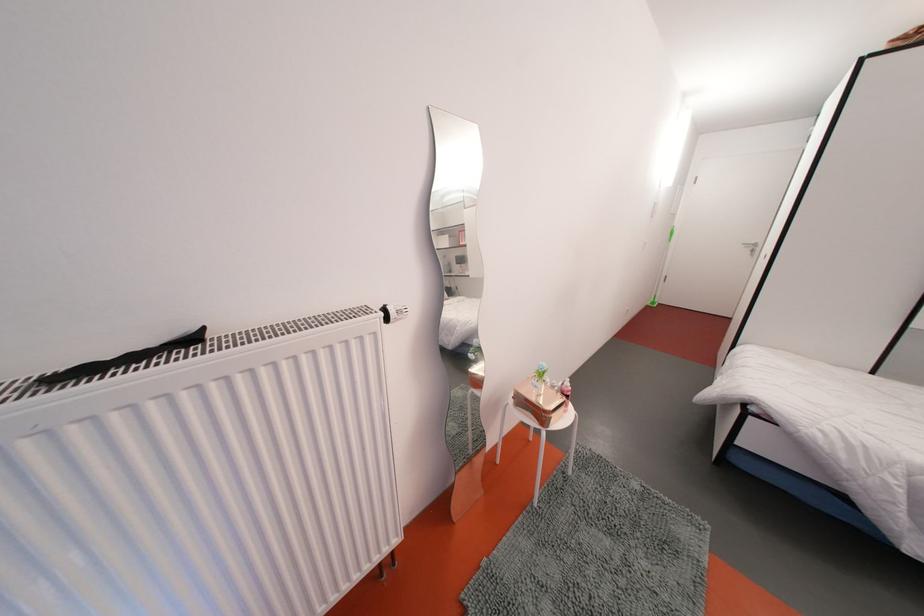
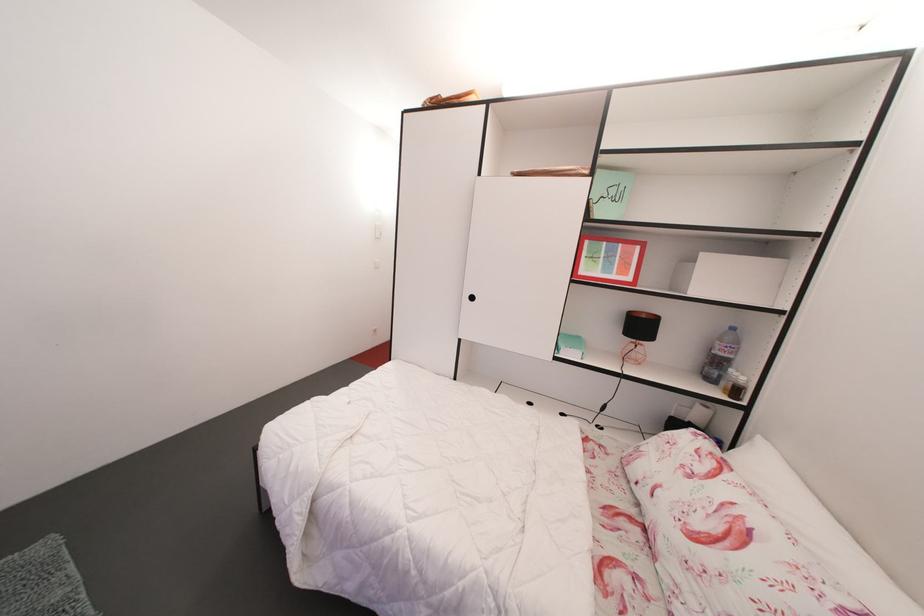
Question: In a continuous first-person perspective shot, in which direction is the camera moving?

Choices:
 (A) Left
 (B) Right
 (C) Forward
 (D) Backward

Answer: (B)